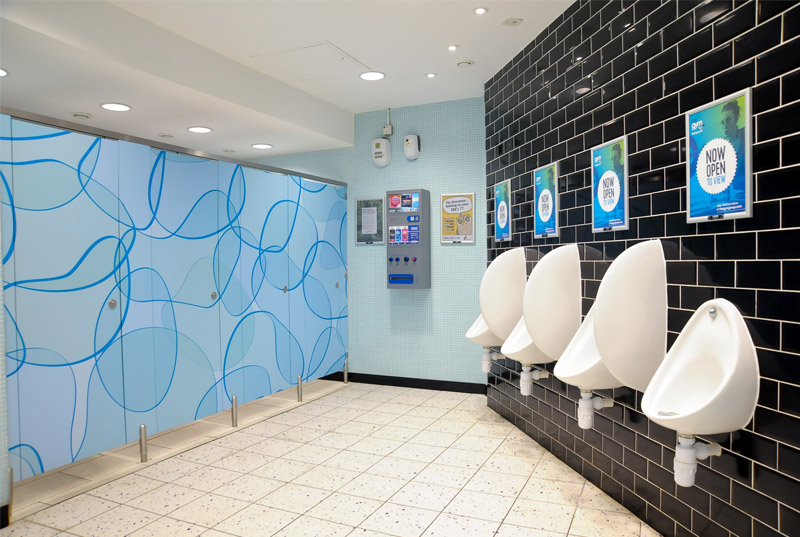
In order to click on urinal in this screenshot , I will do `click(698, 369)`, `click(574, 353)`, `click(522, 344)`, `click(477, 329)`.